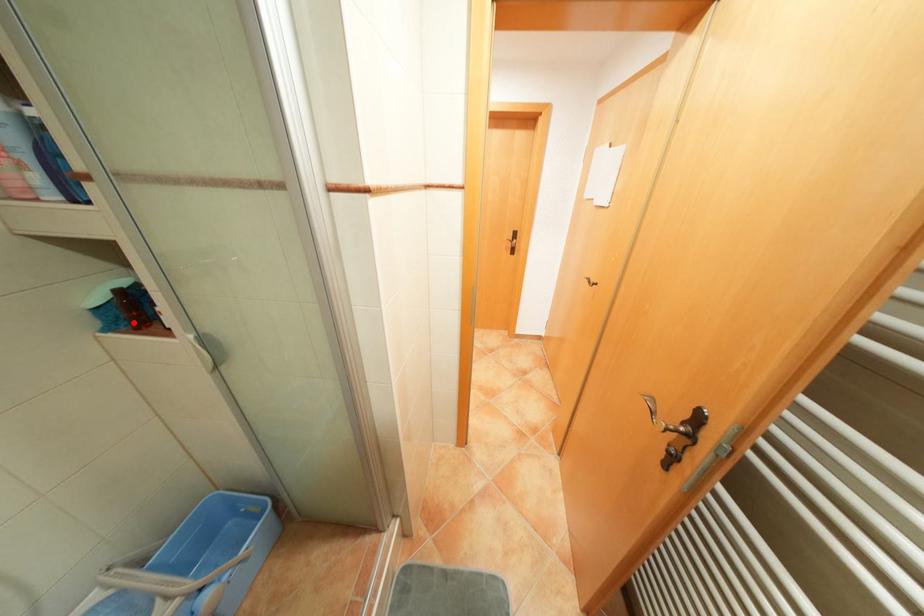
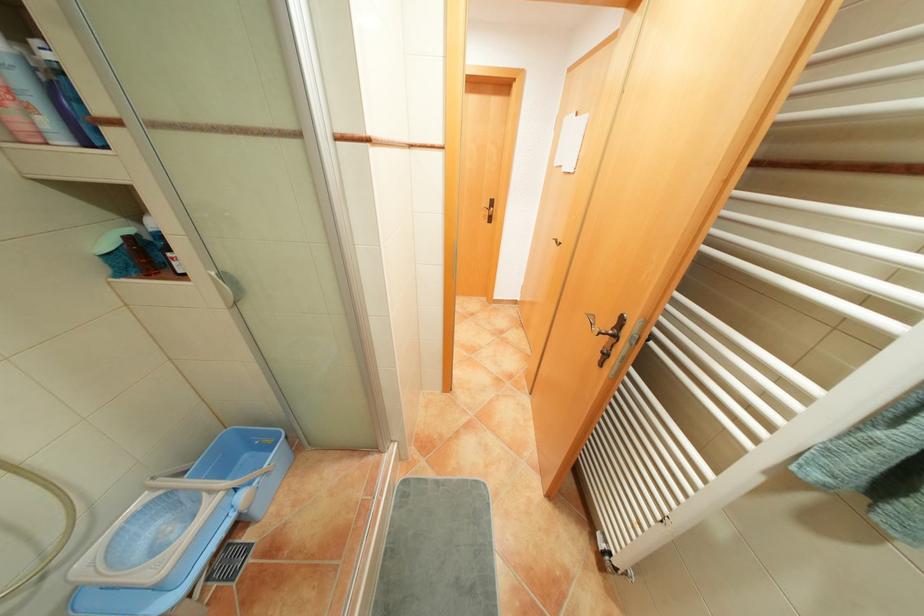
The point at the highlighted location is marked in the first image. Where is the corresponding point in the second image?

(144, 270)